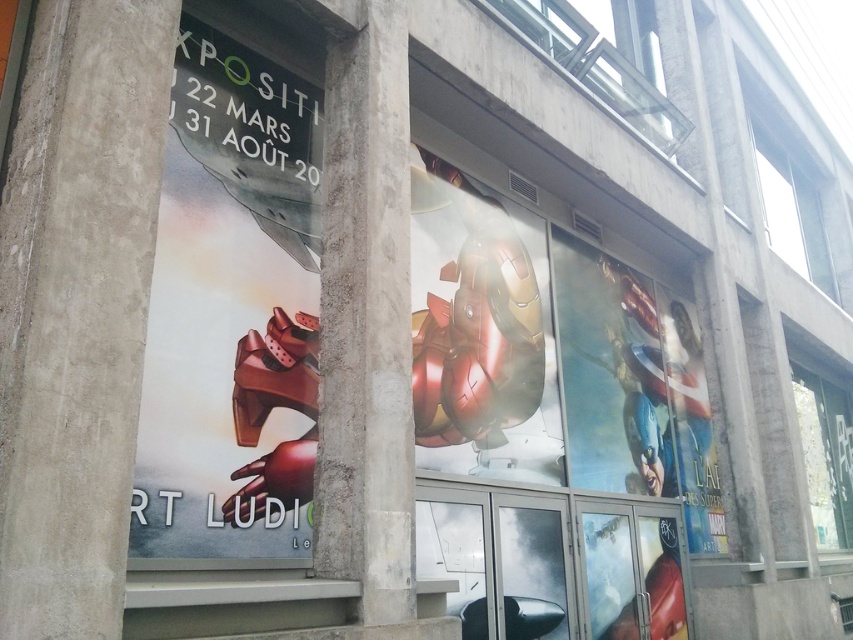
You are standing in front of the building and want to take a photo of the shiny metallic iron man suit at center without the concrete pillar at center blocking the view. Is it possible to move to a position where the pillar is not in the way? Explain your reasoning based on their positions.

The concrete pillar at center is closer to the viewer than the shiny metallic iron man suit at center. Therefore, moving to the side or adjusting your angle could allow you to position yourself so that the pillar no longer blocks the view of the suit. Since the pillar is in front, shifting your position sideways might place the pillar out of the frame while keeping the suit visible.

You are a photographer standing at the camera position. You want to take a photo of the main poster on the left side and the concrete pillar at center. Can you fit both in the frame if your camera has a 60 degree field of view?

The concrete pillar at center and camera are 9.22 feet apart. Since the camera has a 60 degree field of view, the distance between the two objects is within the camera angle, so both can be captured in one frame.